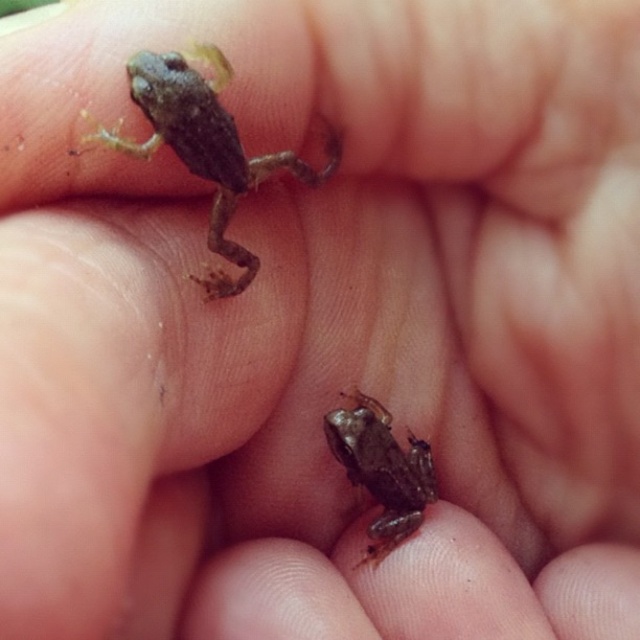
You are a biologist observing two frogs in a hand. The frogs are the smooth brown frog at upper left and the brown matte frog at lower center. Which frog is taller?

The smooth brown frog at upper left is much taller than the brown matte frog at lower center.

You are a researcher studying frog habitats. You observe a frog at point [205,145] in the image. Based on the frog species and its position, can you determine if it is positioned on the palm or between the fingers of the hand holding it?

The frog at point [205,145] is located at the upper left position, which is between the fingers of the hand holding it.